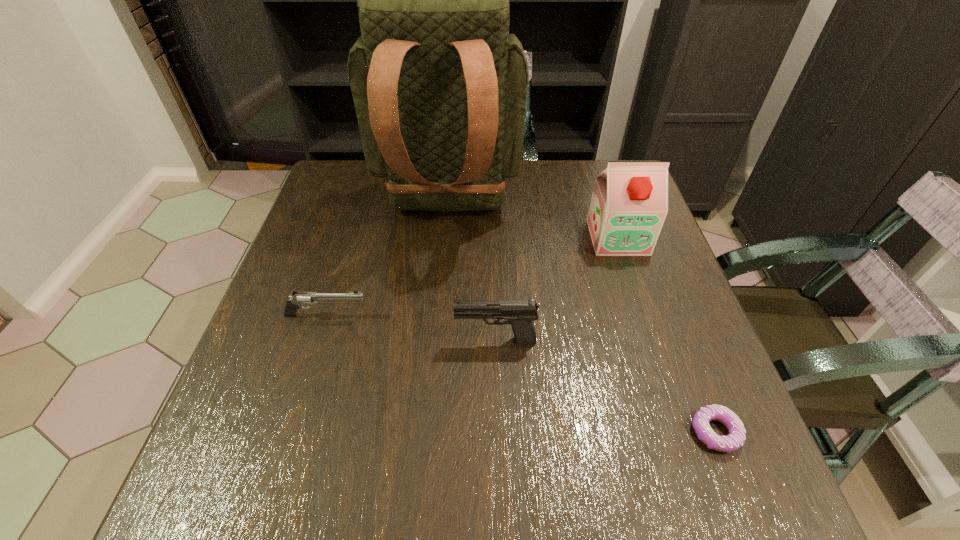
The height and width of the screenshot is (540, 960). I want to click on empty space that is in between the nearest object and the backpack, so click(582, 320).

Locate an element on the screen. The image size is (960, 540). free spot between the shortest object and the third farthest object is located at coordinates (521, 374).

This screenshot has width=960, height=540. I want to click on vacant area between the tallest object and the shortest object, so click(x=582, y=320).

Image resolution: width=960 pixels, height=540 pixels. Identify the location of free area in between the shorter pistol and the doughnut. (521, 374).

Where is `free space between the taller pistol and the doughnut`? The image size is (960, 540). free space between the taller pistol and the doughnut is located at coordinates (606, 386).

Identify which object is the fourth closest to the second shortest object. Please provide its 2D coordinates. Your answer should be formatted as a tuple, i.e. [(x, y)], where the tuple contains the x and y coordinates of a point satisfying the conditions above.

[(736, 438)]

What are the coordinates of `object that stands as the fourth closest to the nearer pistol` in the screenshot? It's located at (629, 204).

Find the location of a particular element. The height and width of the screenshot is (540, 960). blank area in the image that satisfies the following two spatial constraints: 1. aim along the barrel of the taller pistol; 2. on the right side of the shortest object is located at coordinates (498, 432).

Identify the location of vacant space that satisfies the following two spatial constraints: 1. on the back side of the shortest object; 2. on the front-facing side of the farther pistol. This screenshot has width=960, height=540. (670, 315).

Where is `vacant region that satisfies the following two spatial constraints: 1. with the cap open on the fourth shortest object; 2. on the right side of the nearest object`? This screenshot has width=960, height=540. vacant region that satisfies the following two spatial constraints: 1. with the cap open on the fourth shortest object; 2. on the right side of the nearest object is located at coordinates (683, 432).